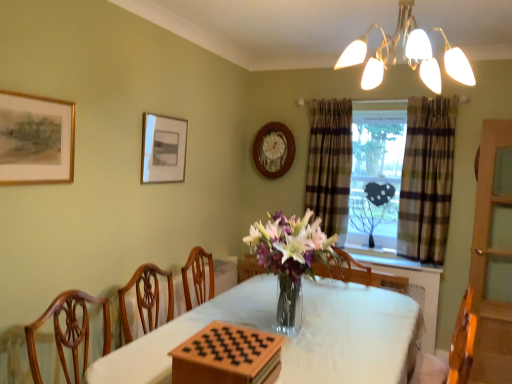
Question: From the image's perspective, does plaid fabric window at center appear higher than translucent glass vase at center?

Choices:
 (A) no
 (B) yes

Answer: (B)

Question: Considering the relative positions of plaid fabric window at center and translucent glass vase at center in the image provided, is plaid fabric window at center to the right of translucent glass vase at center from the viewer's perspective?

Choices:
 (A) yes
 (B) no

Answer: (A)

Question: Is plaid fabric window at center wider than translucent glass vase at center?

Choices:
 (A) yes
 (B) no

Answer: (B)

Question: From a real-world perspective, is plaid fabric window at center positioned over translucent glass vase at center based on gravity?

Choices:
 (A) no
 (B) yes

Answer: (B)

Question: Is plaid fabric window at center facing towards translucent glass vase at center?

Choices:
 (A) no
 (B) yes

Answer: (B)

Question: From the image's perspective, relative to plaid fabric curtain at window, arranged as the 2th curtain when viewed from the left, is wooden clock at upper center, which is the third picture frame in front-to-back order, above or below?

Choices:
 (A) above
 (B) below

Answer: (A)

Question: Do you think wooden clock at upper center, which is the third picture frame in front-to-back order, is within plaid fabric curtain at window, arranged as the 2th curtain when viewed from the left, or outside of it?

Choices:
 (A) outside
 (B) inside

Answer: (A)

Question: From a real-world perspective, is wooden clock at upper center, placed as the first picture frame when sorted from right to left, above or below plaid fabric curtain at window, positioned as the first curtain in right-to-left order?

Choices:
 (A) below
 (B) above

Answer: (B)

Question: Based on their sizes in the image, would you say wooden clock at upper center, which is the third picture frame in front-to-back order, is bigger or smaller than plaid fabric curtain at window, positioned as the first curtain in right-to-left order?

Choices:
 (A) small
 (B) big

Answer: (A)

Question: From the image's perspective, is plaid fabric curtain at window, positioned as the first curtain in right-to-left order, positioned above or below plaid fabric window at center?

Choices:
 (A) below
 (B) above

Answer: (A)

Question: Is plaid fabric curtain at window, positioned as the first curtain in right-to-left order, situated inside plaid fabric window at center or outside?

Choices:
 (A) inside
 (B) outside

Answer: (B)

Question: From a real-world perspective, is plaid fabric curtain at window, positioned as the first curtain in right-to-left order, physically located above or below plaid fabric window at center?

Choices:
 (A) above
 (B) below

Answer: (A)

Question: Looking at their shapes, would you say plaid fabric curtain at window, positioned as the first curtain in right-to-left order, is wider or thinner than plaid fabric window at center?

Choices:
 (A) wide
 (B) thin

Answer: (A)

Question: Does point (318, 372) appear closer or farther from the camera than point (442, 243)?

Choices:
 (A) farther
 (B) closer

Answer: (B)

Question: Is white cloth-covered table at center taller or shorter than plaid fabric window at center?

Choices:
 (A) tall
 (B) short

Answer: (B)